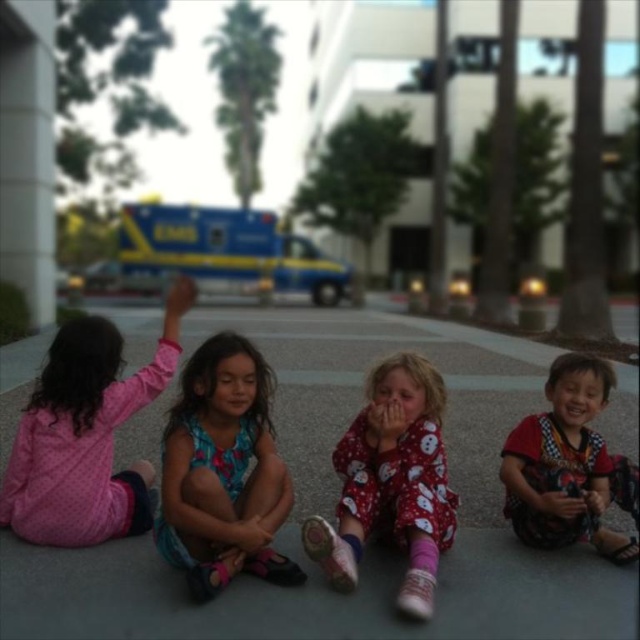
Can you confirm if gray concrete pavement at center is taller than blue floral dress at center?

Indeed, gray concrete pavement at center has a greater height compared to blue floral dress at center.

Where is `gray concrete pavement at center`? The height and width of the screenshot is (640, 640). gray concrete pavement at center is located at coordinates (333, 506).

I want to click on gray concrete pavement at center, so click(x=333, y=506).

Can you confirm if blue floral dress at center is bigger than blue metallic ambulance at upper center?

Actually, blue floral dress at center might be smaller than blue metallic ambulance at upper center.

Can you confirm if blue floral dress at center is positioned above blue metallic ambulance at upper center?

No.

Where is `blue floral dress at center`? This screenshot has height=640, width=640. blue floral dress at center is located at coordinates (224, 472).

Is point (90, 420) positioned after point (241, 518)?

Yes.

Consider the image. Does pink polka dot pajamas at left appear under blue floral dress at center?

No, pink polka dot pajamas at left is not below blue floral dress at center.

Does point (83, 371) come farther from viewer compared to point (164, 506)?

Yes, point (83, 371) is behind point (164, 506).

Locate an element on the screen. The height and width of the screenshot is (640, 640). pink polka dot pajamas at left is located at coordinates (84, 435).